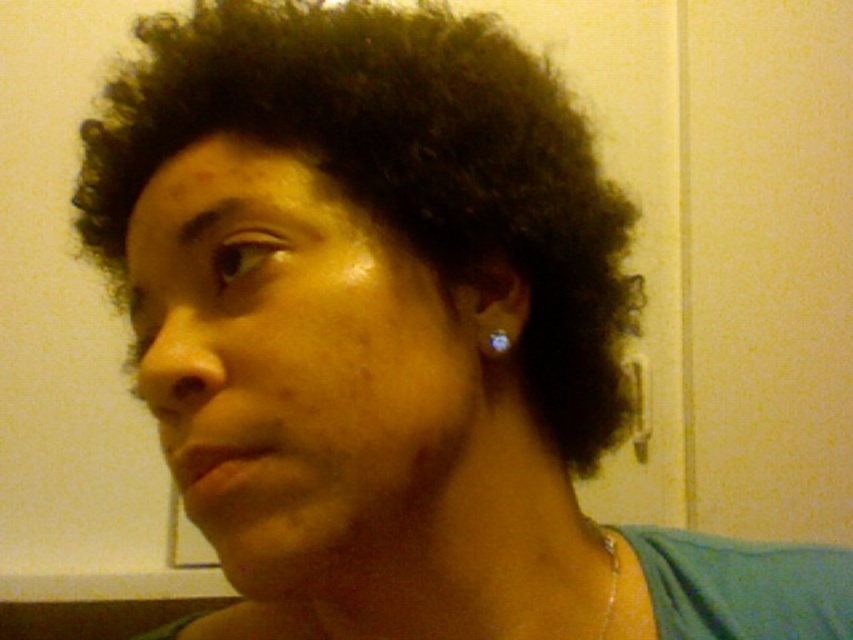
Does gold metallic necklace at lower center appear on the left side of silver metallic earring at ear?

In fact, gold metallic necklace at lower center is to the right of silver metallic earring at ear.

Is point (621, 612) positioned behind point (497, 346)?

Yes, it is behind point (497, 346).

This screenshot has width=853, height=640. Find the location of `gold metallic necklace at lower center`. gold metallic necklace at lower center is located at coordinates (613, 582).

Can you confirm if dark curly hair at center is wider than gold metallic necklace at lower center?

Yes, dark curly hair at center is wider than gold metallic necklace at lower center.

Does dark curly hair at center appear over gold metallic necklace at lower center?

Yes, dark curly hair at center is above gold metallic necklace at lower center.

Between point (567, 276) and point (619, 625), which one is positioned behind?

Positioned behind is point (619, 625).

The width and height of the screenshot is (853, 640). Identify the location of dark curly hair at center. (399, 166).

How distant is dark curly hair at center from silver metallic earring at ear?

4.47 inches

Between dark curly hair at center and silver metallic earring at ear, which one appears on the right side from the viewer's perspective?

Positioned to the right is silver metallic earring at ear.

Where is `dark curly hair at center`? The image size is (853, 640). dark curly hair at center is located at coordinates (399, 166).